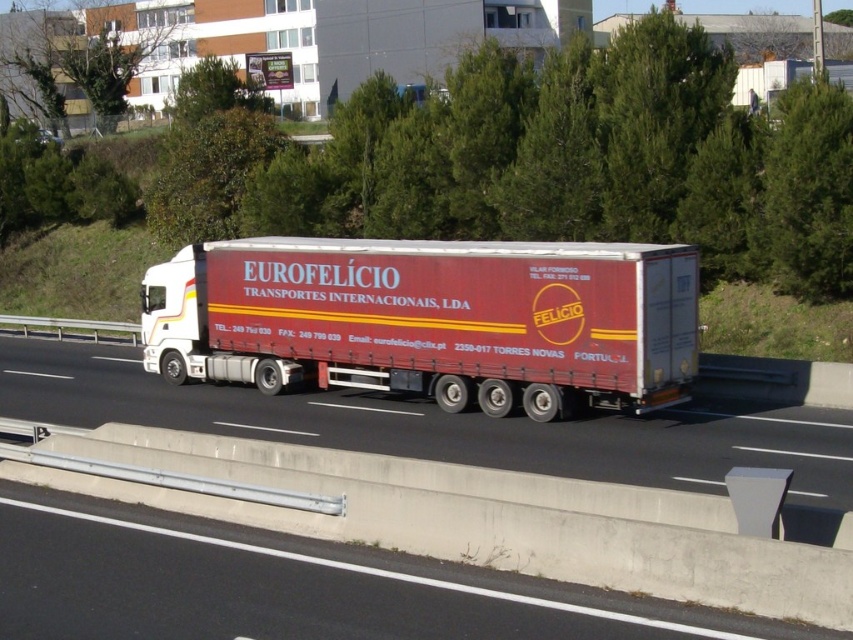
You are a delivery driver who needs to identify the exact location of the truck in the image. According to the coordinate system where the bottom left corner is the origin, which object is located at point (x=431, y=320)?

The point (x=431, y=320) indicates the location of the matte red trailer truck at center.

You are a passenger in the semi truck and looking out the window. You notice two points on the road ahead. The first point is at coordinate point (436, 396) and the second is at coordinate point (746, 429). Which point is closer to the truck?

Point (436, 396) is behind point (746, 429), so the point closer to the truck is point (746, 429).